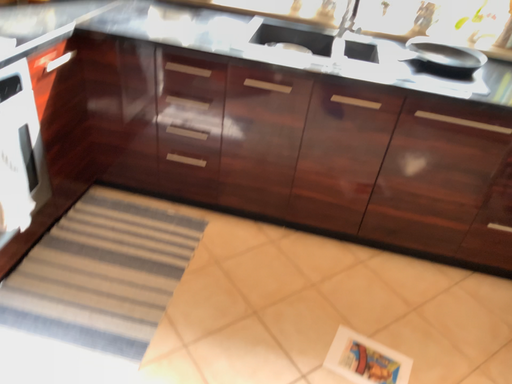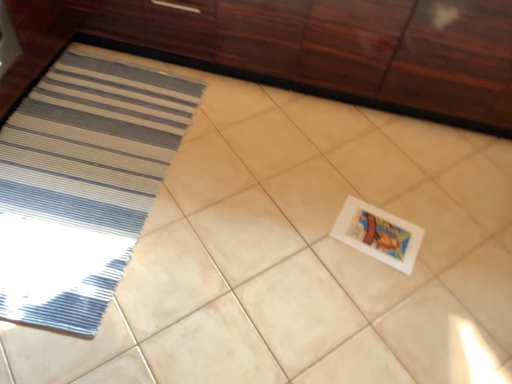
Question: Which way did the camera rotate in the video?

Choices:
 (A) rotated upward
 (B) rotated downward

Answer: (B)